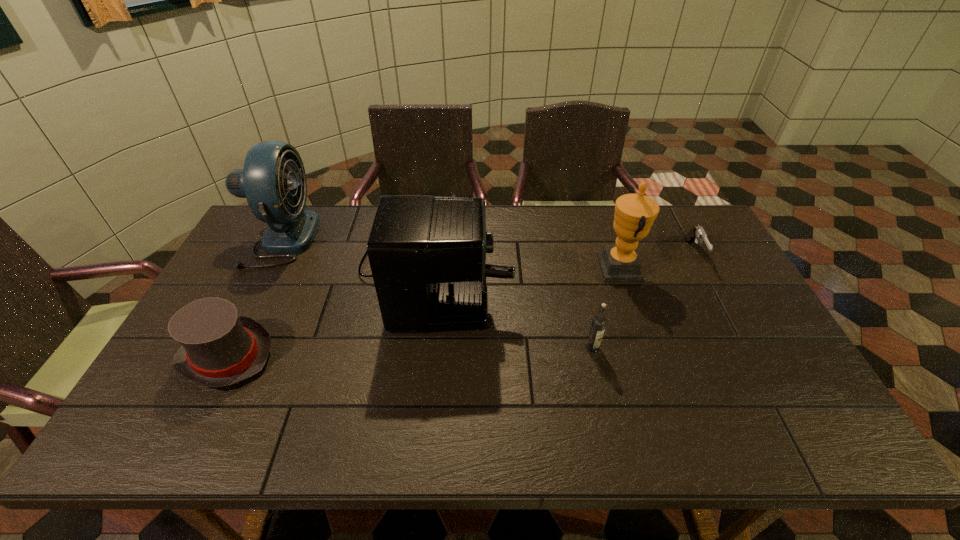
Where is `vacant space located at the front of the fifth object from left to right with handles`? The width and height of the screenshot is (960, 540). vacant space located at the front of the fifth object from left to right with handles is located at coordinates (524, 268).

Image resolution: width=960 pixels, height=540 pixels. Identify the location of vacant area situated 0.120m at the front of the fifth object from left to right with handles. (562, 268).

I want to click on vacant space situated 0.090m on the front-facing side of the fourth object from right to left, so click(539, 266).

Find the location of a particular element. The height and width of the screenshot is (540, 960). vacant space located on the label of the third shortest object is located at coordinates (604, 401).

In order to click on vacant space situated 0.350m on the right of the second shortest object in this screenshot , I will do `click(407, 355)`.

Where is `vacant region located 0.140m at the muzzle of the gun`? The width and height of the screenshot is (960, 540). vacant region located 0.140m at the muzzle of the gun is located at coordinates (721, 302).

Where is `fan situated at the far edge`? The image size is (960, 540). fan situated at the far edge is located at coordinates (271, 167).

Image resolution: width=960 pixels, height=540 pixels. Identify the location of coffee maker that is at the far edge. (427, 254).

The width and height of the screenshot is (960, 540). What are the coordinates of `gun that is at the far edge` in the screenshot? It's located at (697, 233).

This screenshot has height=540, width=960. I want to click on fan present at the left edge, so click(x=271, y=167).